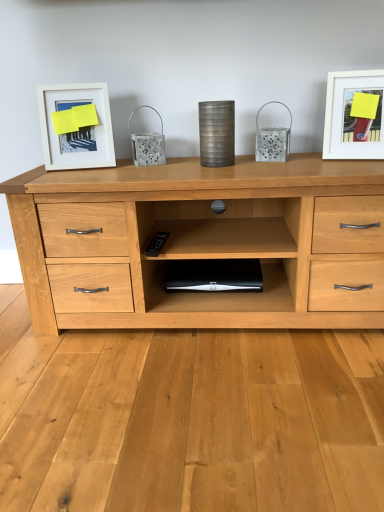
Question: Does white matte picture frame at upper right, which is the 1th picture frame in right-to-left order, have a lesser width compared to black plastic computer at center?

Choices:
 (A) no
 (B) yes

Answer: (B)

Question: Is white matte picture frame at upper right, which is the 1th picture frame in right-to-left order, located outside black plastic computer at center?

Choices:
 (A) no
 (B) yes

Answer: (B)

Question: Is white matte picture frame at upper right, which is the 1th picture frame in right-to-left order, facing towards black plastic computer at center?

Choices:
 (A) no
 (B) yes

Answer: (A)

Question: From a real-world perspective, is white matte picture frame at upper right, the 2th picture frame positioned from the left, under black plastic computer at center?

Choices:
 (A) no
 (B) yes

Answer: (A)

Question: Is white matte picture frame at upper right, the 2th picture frame positioned from the left, bigger than black plastic computer at center?

Choices:
 (A) no
 (B) yes

Answer: (B)

Question: Is white matte picture frame at upper right, the 2th picture frame positioned from the left, surrounding black plastic computer at center?

Choices:
 (A) no
 (B) yes

Answer: (A)

Question: Does white matte picture frame at upper right, which is the 1th picture frame in right-to-left order, appear on the right side of white matte picture frame at upper left, acting as the 2th picture frame starting from the right?

Choices:
 (A) no
 (B) yes

Answer: (B)

Question: Is white matte picture frame at upper right, the 2th picture frame positioned from the left, located outside white matte picture frame at upper left, acting as the 2th picture frame starting from the right?

Choices:
 (A) no
 (B) yes

Answer: (B)

Question: From the image's perspective, is white matte picture frame at upper right, the 2th picture frame positioned from the left, beneath white matte picture frame at upper left, acting as the 2th picture frame starting from the right?

Choices:
 (A) no
 (B) yes

Answer: (A)

Question: From a real-world perspective, is white matte picture frame at upper right, which is the 1th picture frame in right-to-left order, positioned under white matte picture frame at upper left, acting as the 2th picture frame starting from the right, based on gravity?

Choices:
 (A) yes
 (B) no

Answer: (A)

Question: Is white matte picture frame at upper left, acting as the 2th picture frame starting from the right, surrounded by white matte picture frame at upper right, the 2th picture frame positioned from the left?

Choices:
 (A) yes
 (B) no

Answer: (B)

Question: Is white matte picture frame at upper right, which is the 1th picture frame in right-to-left order, positioned far away from white matte picture frame at upper left, arranged as the first picture frame when viewed from the left?

Choices:
 (A) no
 (B) yes

Answer: (A)

Question: From a real-world perspective, is white matte picture frame at upper left, acting as the 2th picture frame starting from the right, located higher than white matte picture frame at upper right, which is the 1th picture frame in right-to-left order?

Choices:
 (A) no
 (B) yes

Answer: (B)